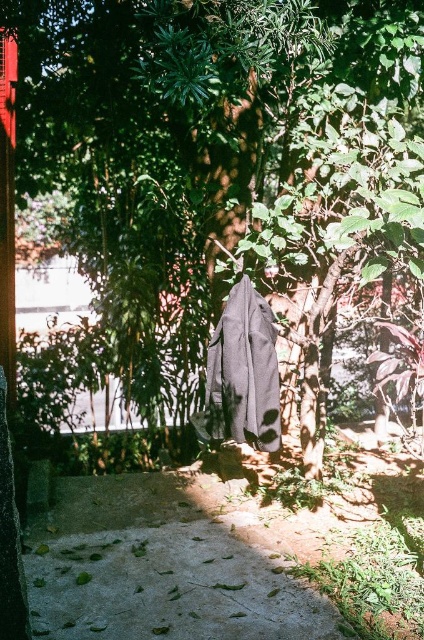
Does green leafy tree at center have a lesser width compared to dark gray fabric robe at center?

Incorrect, green leafy tree at center's width is not less than dark gray fabric robe at center's.

Does green leafy tree at center have a greater height compared to dark gray fabric robe at center?

Correct, green leafy tree at center is much taller as dark gray fabric robe at center.

I want to click on green leafy tree at center, so click(x=200, y=132).

You are a GUI agent. You are given a task and a screenshot of the screen. Output one action in this format:
    pyautogui.click(x=<x>, y=<y>)
    Task: Click on the green leafy tree at center
    The width and height of the screenshot is (424, 640).
    Given the screenshot: What is the action you would take?
    pyautogui.click(x=200, y=132)

Which is more to the right, green leafy tree at center or concrete at lower center?

green leafy tree at center is more to the right.

The width and height of the screenshot is (424, 640). What do you see at coordinates (200, 132) in the screenshot?
I see `green leafy tree at center` at bounding box center [200, 132].

Identify the location of green leafy tree at center. Image resolution: width=424 pixels, height=640 pixels. (200, 132).

Between concrete at lower center and dark gray fabric robe at center, which one has more height?

dark gray fabric robe at center is taller.

Who is more distant from viewer, (192,531) or (223,365)?

The point (223,365) is behind.

Locate an element on the screen. concrete at lower center is located at coordinates (162, 566).